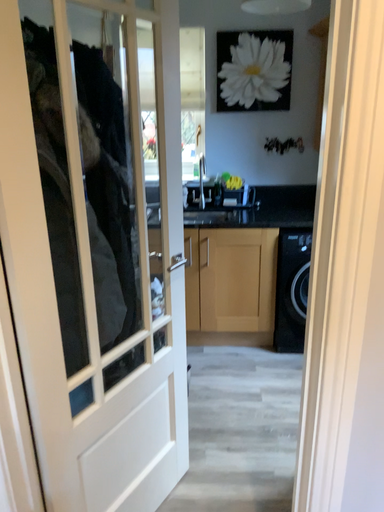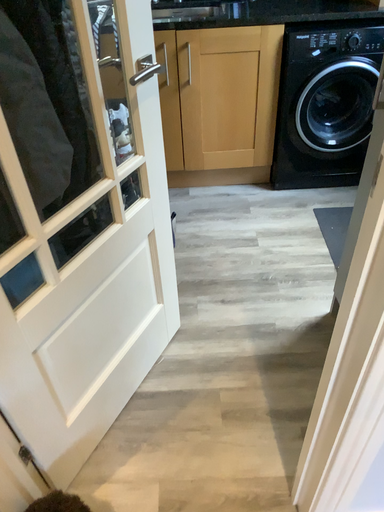
Question: Which way did the camera rotate in the video?

Choices:
 (A) rotated downward
 (B) rotated upward

Answer: (A)